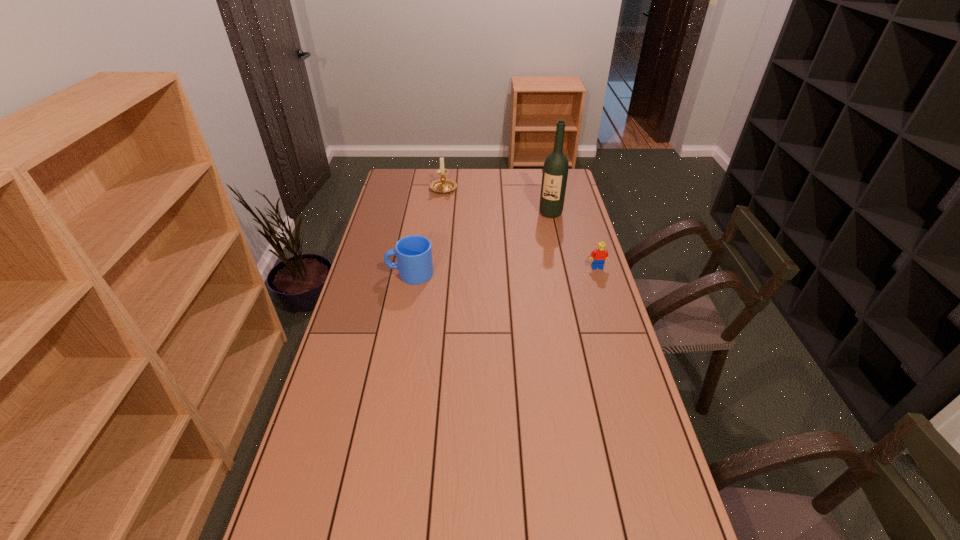
Locate an element on the screen. The height and width of the screenshot is (540, 960). vacant space at the far edge is located at coordinates (472, 170).

In order to click on free space at the near edge of the desktop in this screenshot , I will do `click(487, 526)`.

In order to click on free spot at the left edge of the desktop in this screenshot , I will do `click(396, 231)`.

Where is `vacant space at the right edge of the desktop`? vacant space at the right edge of the desktop is located at coordinates (585, 397).

Identify the location of empty space between the candle holder and the rightmost object. (520, 228).

Where is `vacant space that's between the farthest object and the third nearest object`? The width and height of the screenshot is (960, 540). vacant space that's between the farthest object and the third nearest object is located at coordinates pos(497,201).

You are a GUI agent. You are given a task and a screenshot of the screen. Output one action in this format:
    pyautogui.click(x=<x>, y=<y>)
    Task: Click on the vacant point located between the second object from right to left and the farthest object
    The width and height of the screenshot is (960, 540).
    Given the screenshot: What is the action you would take?
    [497, 201]

You are a GUI agent. You are given a task and a screenshot of the screen. Output one action in this format:
    pyautogui.click(x=<x>, y=<y>)
    Task: Click on the vacant space that is in between the rightmost object and the mug
    The height and width of the screenshot is (540, 960).
    Given the screenshot: What is the action you would take?
    pyautogui.click(x=504, y=271)

Image resolution: width=960 pixels, height=540 pixels. In order to click on free spot between the second tallest object and the Lego in this screenshot , I will do click(520, 228).

What are the coordinates of `free spot between the rightmost object and the second farthest object` in the screenshot? It's located at (574, 240).